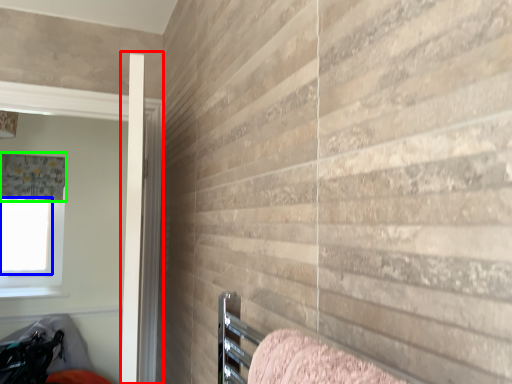
Question: Considering the real-world distances, which object is farthest from screen door (highlighted by a red box)? window screen (highlighted by a blue box) or curtain (highlighted by a green box)?

Choices:
 (A) window screen
 (B) curtain

Answer: (A)